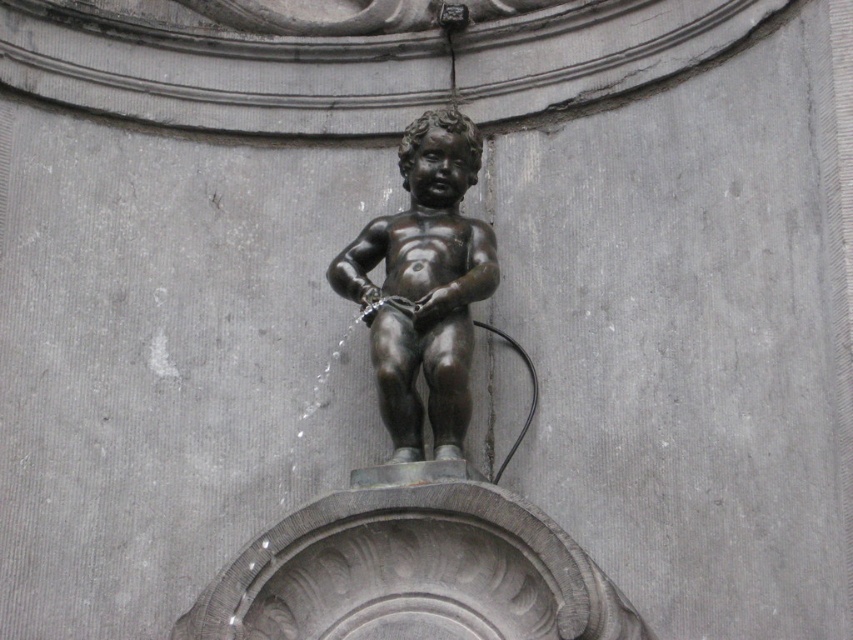
Question: Among these points, which one is farthest from the camera?

Choices:
 (A) 424,227
 (B) 412,355

Answer: (A)

Question: Which point is farther to the camera?

Choices:
 (A) (412, 324)
 (B) (339, 504)

Answer: (A)

Question: Considering the relative positions of bronze statue at center and shiny bronze statue at center in the image provided, where is bronze statue at center located with respect to shiny bronze statue at center?

Choices:
 (A) below
 (B) above

Answer: (B)

Question: Is bronze statue at center thinner than shiny bronze statue at center?

Choices:
 (A) no
 (B) yes

Answer: (A)

Question: Does bronze statue at center appear on the right side of shiny bronze statue at center?

Choices:
 (A) yes
 (B) no

Answer: (B)

Question: Which point is closer to the camera?

Choices:
 (A) bronze statue at center
 (B) shiny bronze statue at center

Answer: (A)